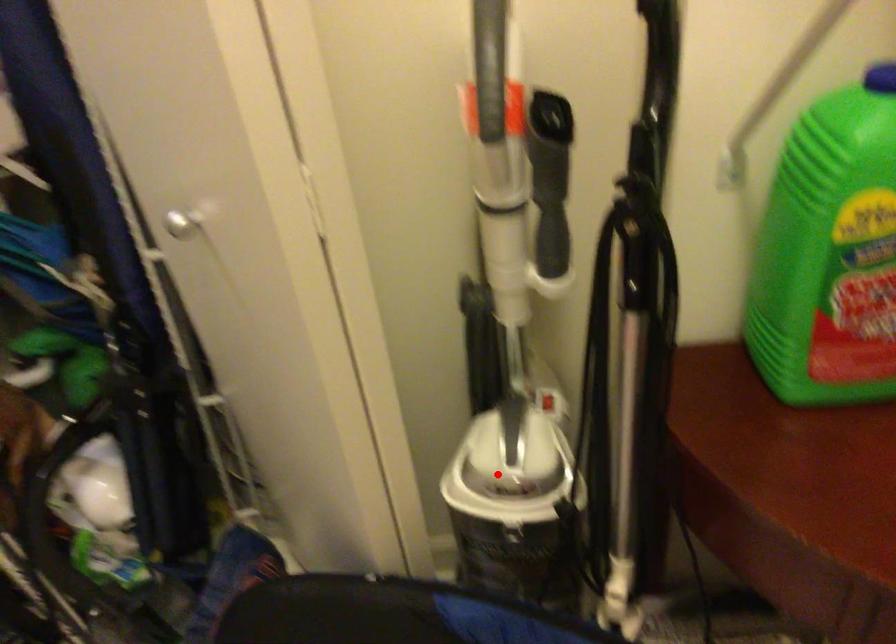
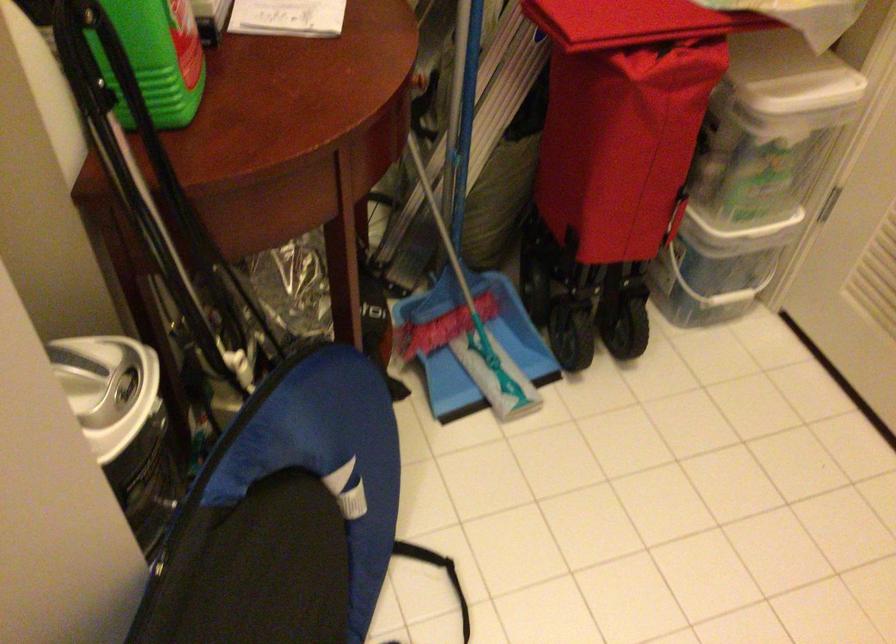
Where in the second image is the point corresponding to the highlighted location from the first image?

(107, 388)